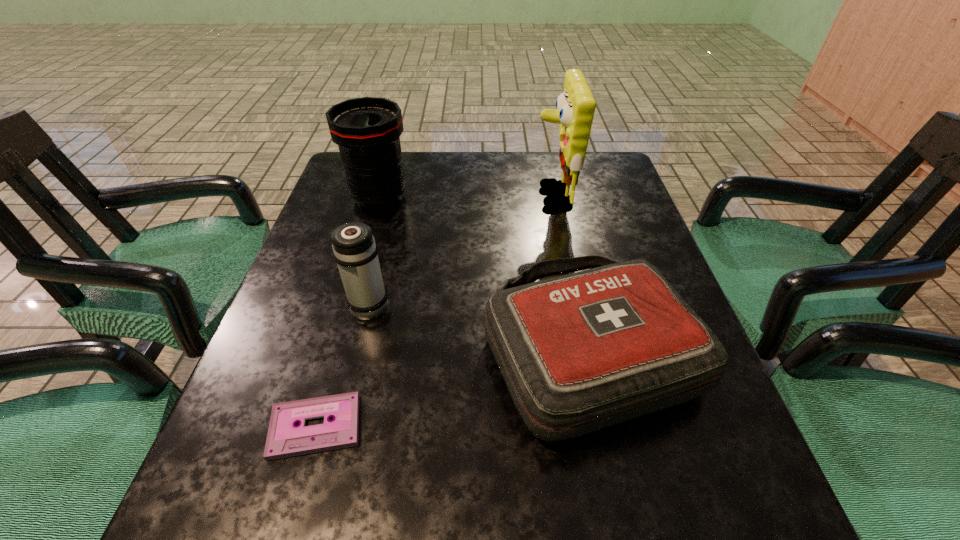
Where is `the second closest object to the thermos bottle`? This screenshot has height=540, width=960. the second closest object to the thermos bottle is located at coordinates (580, 352).

Locate an element on the screen. This screenshot has height=540, width=960. blank area in the image that satisfies the following two spatial constraints: 1. on the back side of the fourth tallest object; 2. on the face of the tallest object is located at coordinates (556, 197).

At what (x,y) coordinates should I click in order to perform the action: click on free space that satisfies the following two spatial constraints: 1. on the face of the first-aid kit; 2. on the right side of the sponge. Please return your answer as a coordinate pair (x, y). Looking at the image, I should click on (584, 350).